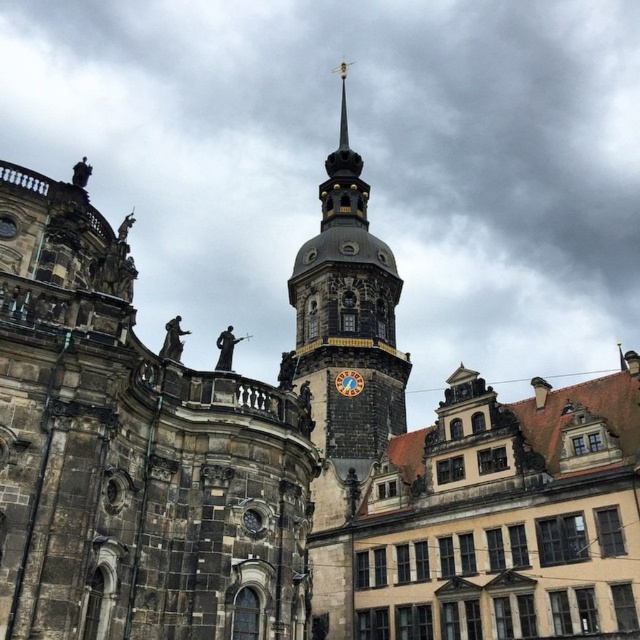
Question: Where is golden ornate clock tower at center located in relation to matte brown clock at center in the image?

Choices:
 (A) below
 (B) above

Answer: (B)

Question: Is golden ornate clock tower at center wider than matte brown clock at center?

Choices:
 (A) yes
 (B) no

Answer: (A)

Question: Which of the following is the farthest from the observer?

Choices:
 (A) golden ornate clock tower at center
 (B) matte brown clock at center

Answer: (B)

Question: Does golden ornate clock tower at center have a larger size compared to matte brown clock at center?

Choices:
 (A) no
 (B) yes

Answer: (B)

Question: Which point is farther to the camera?

Choices:
 (A) (374, 445)
 (B) (353, 369)

Answer: (B)